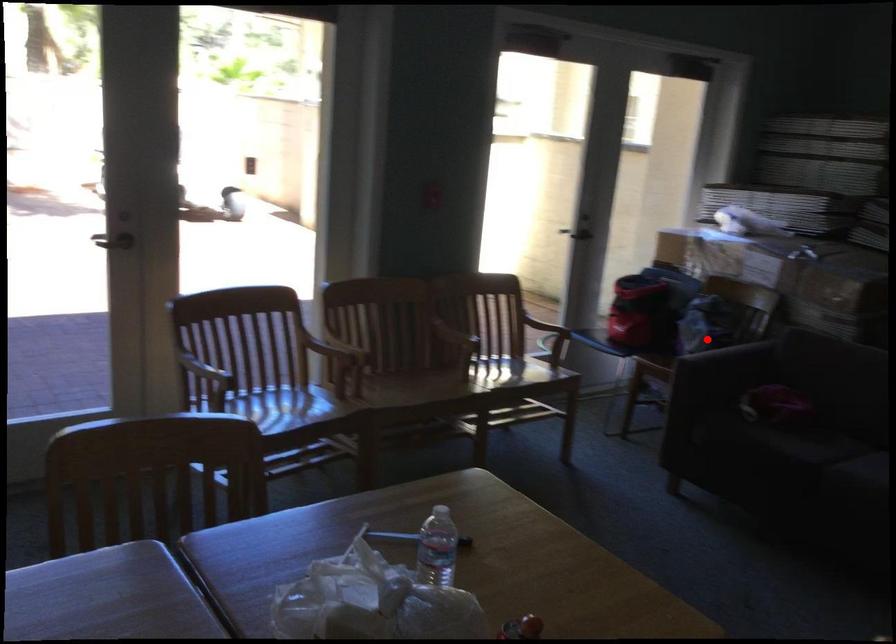
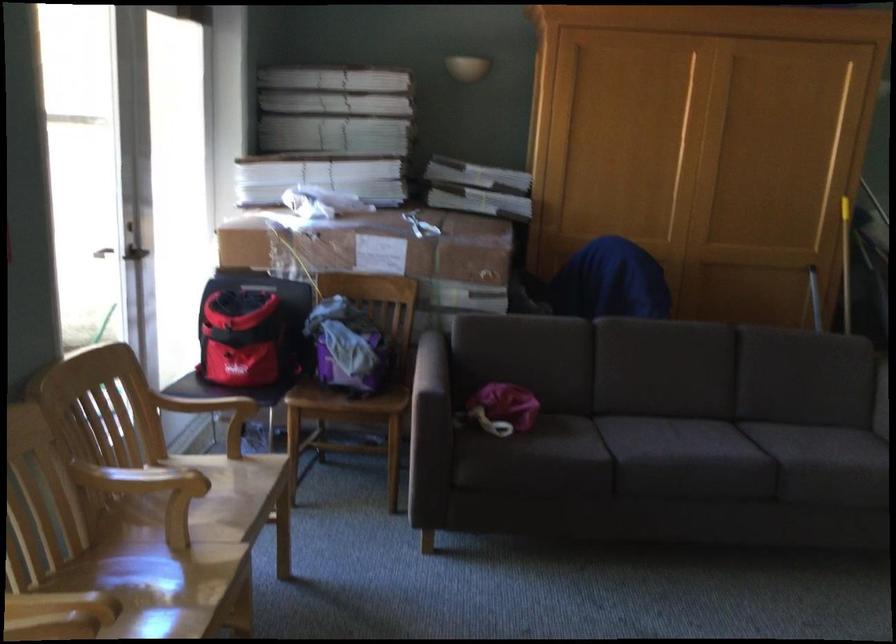
Question: I am providing you with two images of the same scene from different viewpoints. A red point is shown in image1. For the corresponding object point in image2, is it positioned nearer or farther from the camera?

Choices:
 (A) Nearer
 (B) Farther

Answer: (A)